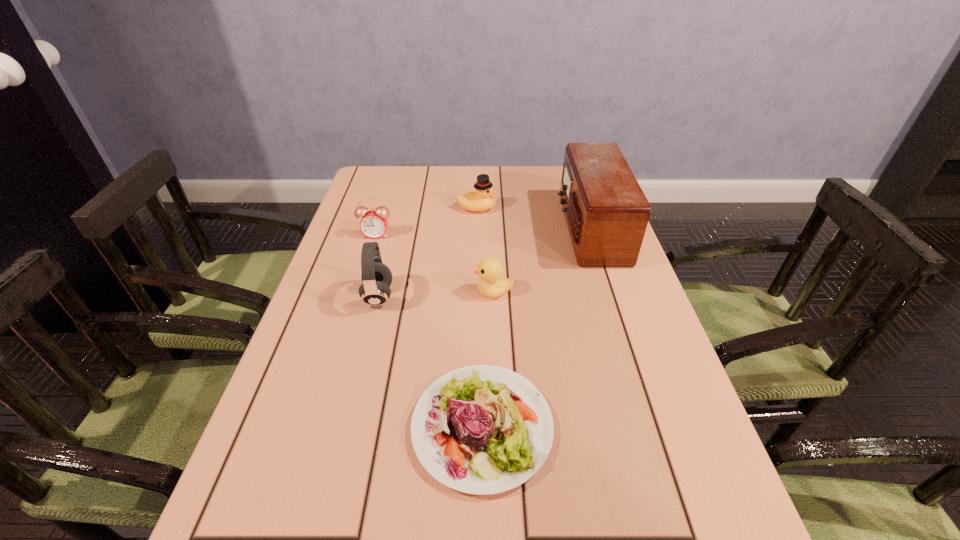
Locate an element on the screen. This screenshot has width=960, height=540. free space located 0.400m on the front-facing side of the tallest object is located at coordinates [x=424, y=229].

The width and height of the screenshot is (960, 540). Identify the location of vacant space located on the ear cups of the fifth shortest object. (497, 296).

This screenshot has width=960, height=540. I want to click on free space located on the clock face of the alarm clock, so click(341, 350).

Locate an element on the screen. blank area located 0.080m on the front-facing side of the farther duck is located at coordinates (523, 208).

Locate an element on the screen. This screenshot has height=540, width=960. free point located 0.300m on the face of the nearer duck is located at coordinates (351, 292).

I want to click on free space located on the face of the nearer duck, so [x=368, y=292].

At what (x,y) coordinates should I click in order to perform the action: click on vacant space located on the face of the nearer duck. Please return your answer as a coordinate pair (x, y). Looking at the image, I should click on (368, 292).

Image resolution: width=960 pixels, height=540 pixels. Find the location of `free space located 0.390m on the back of the salad plate`. free space located 0.390m on the back of the salad plate is located at coordinates (482, 253).

The width and height of the screenshot is (960, 540). I want to click on radio receiver present at the far edge, so click(606, 211).

You are a GUI agent. You are given a task and a screenshot of the screen. Output one action in this format:
    pyautogui.click(x=<x>, y=<y>)
    Task: Click on the duck present at the far edge
    The height and width of the screenshot is (540, 960).
    Given the screenshot: What is the action you would take?
    pyautogui.click(x=480, y=200)